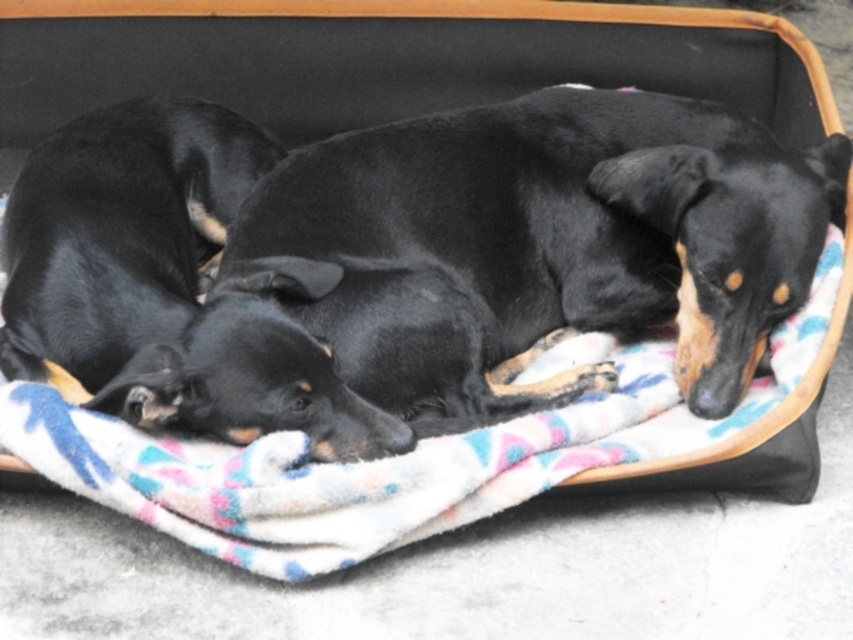
You are a veterinarian examining an image of a pet bed with a black smooth dog at center. Based on the coordinates provided, where exactly is the black smooth dog positioned within the image?

The black smooth dog at center is located at point coordinates of 0.386 on the x axis and 0.627 on the y axis.

You are a photographer trying to capture the two black dogs resting on the fuzzy multicolored blanket at center. Where should you position your camera to ensure the blanket is centered in your shot?

To center the fuzzy multicolored blanket at center in your shot, position your camera at the coordinates corresponding to point (390, 458), as the blanket is located there.